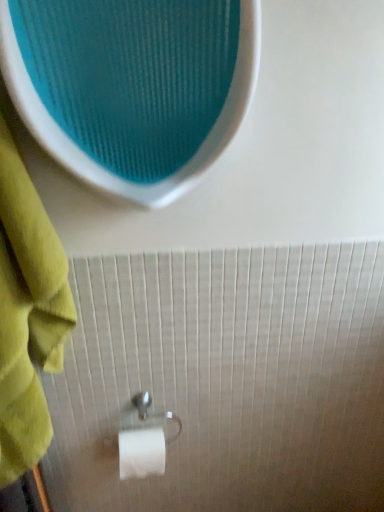
Question: From a real-world perspective, is green cotton towel at left on satin silver toilet paper holder at lower center?

Choices:
 (A) no
 (B) yes

Answer: (B)

Question: Considering the relative positions of green cotton towel at left and satin silver toilet paper holder at lower center in the image provided, is green cotton towel at left in front of satin silver toilet paper holder at lower center?

Choices:
 (A) no
 (B) yes

Answer: (B)

Question: Is green cotton towel at left positioned with its back to satin silver toilet paper holder at lower center?

Choices:
 (A) no
 (B) yes

Answer: (A)

Question: Is green cotton towel at left smaller than satin silver toilet paper holder at lower center?

Choices:
 (A) yes
 (B) no

Answer: (B)

Question: Does green cotton towel at left touch satin silver toilet paper holder at lower center?

Choices:
 (A) yes
 (B) no

Answer: (B)

Question: Does green cotton towel at left have a greater height compared to satin silver toilet paper holder at lower center?

Choices:
 (A) no
 (B) yes

Answer: (B)

Question: Are satin silver toilet paper holder at lower center and green cotton towel at left located far from each other?

Choices:
 (A) no
 (B) yes

Answer: (A)

Question: Considering the relative sizes of satin silver toilet paper holder at lower center and green cotton towel at left in the image provided, is satin silver toilet paper holder at lower center wider than green cotton towel at left?

Choices:
 (A) no
 (B) yes

Answer: (A)

Question: Could you tell me if satin silver toilet paper holder at lower center is turned towards green cotton towel at left?

Choices:
 (A) yes
 (B) no

Answer: (B)

Question: From a real-world perspective, is satin silver toilet paper holder at lower center positioned over green cotton towel at left based on gravity?

Choices:
 (A) yes
 (B) no

Answer: (B)

Question: From a real-world perspective, is satin silver toilet paper holder at lower center positioned under green cotton towel at left based on gravity?

Choices:
 (A) no
 (B) yes

Answer: (B)

Question: Is satin silver toilet paper holder at lower center next to green cotton towel at left and touching it?

Choices:
 (A) no
 (B) yes

Answer: (A)

Question: Looking at the image, does satin silver toilet paper holder at lower center seem bigger or smaller compared to green cotton towel at left?

Choices:
 (A) small
 (B) big

Answer: (A)